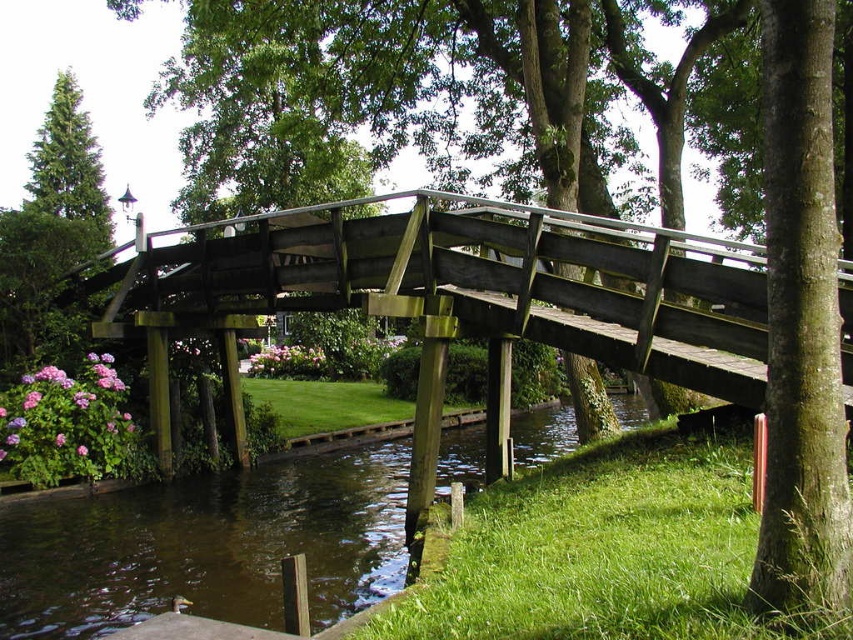
You are a hiker who wants to determine which tree is taller between the smooth brown tree trunk at right and the green matte tree at upper left. Based on the scene, which one is taller?

The green matte tree at upper left is taller than the smooth brown tree trunk at right.